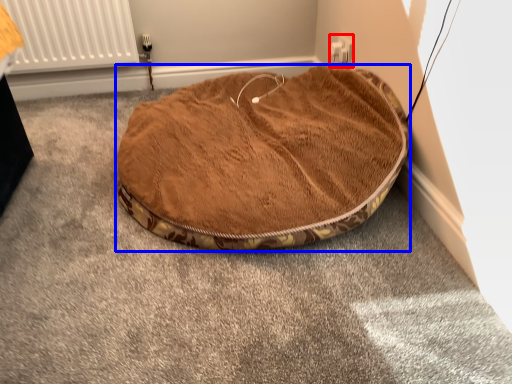
Question: Among these objects, which one is farthest to the camera, electric outlet (highlighted by a red box) or dog bed (highlighted by a blue box)?

Choices:
 (A) electric outlet
 (B) dog bed

Answer: (A)